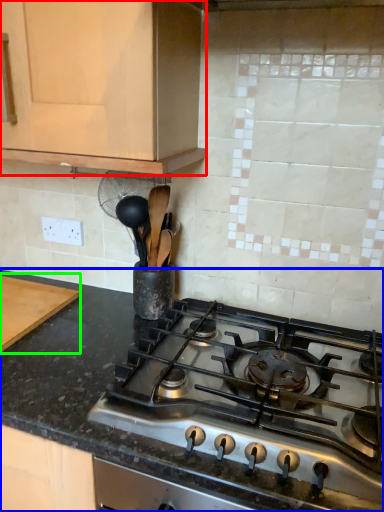
Question: Based on their relative distances, which object is farther from cabinetry (highlighted by a red box)? Choose from countertop (highlighted by a blue box) and cutting board (highlighted by a green box).

Choices:
 (A) countertop
 (B) cutting board

Answer: (B)